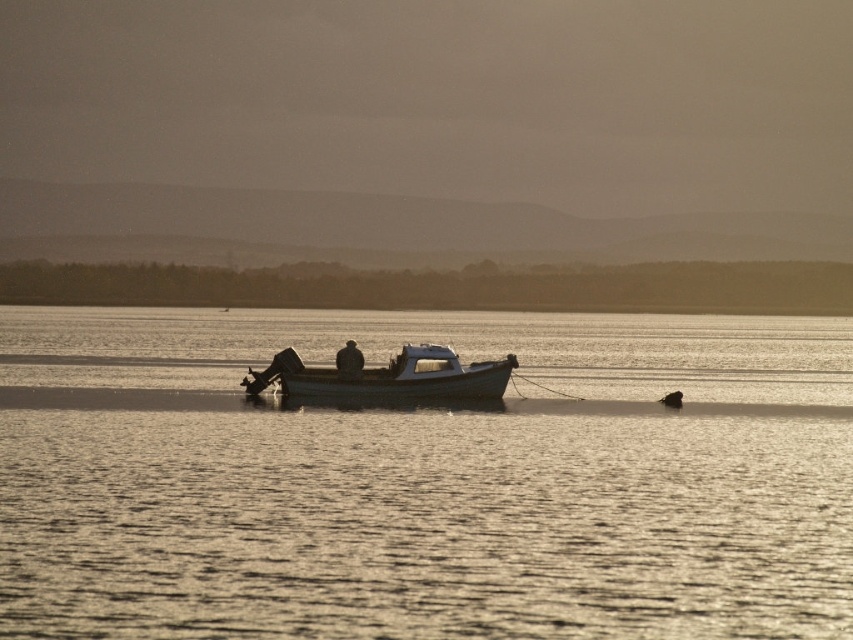
You are a photographer trying to capture the white matte boat at center and the dark textured jacket at center in a single shot. Based on their positions, will the boat appear closer to the camera than the jacket?

The white matte boat at center is in front of dark textured jacket at center, so yes, the boat will appear closer to the camera than the jacket.